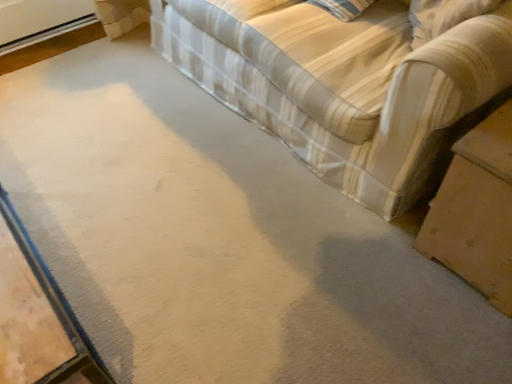
Question: Choose the correct answer: Is striped fabric couch at upper right inside wooden table at lower right or outside it?

Choices:
 (A) outside
 (B) inside

Answer: (A)

Question: From a real-world perspective, is striped fabric couch at upper right above or below wooden table at lower right?

Choices:
 (A) above
 (B) below

Answer: (A)

Question: Considering the positions of striped fabric couch at upper right and wooden table at lower right in the image, is striped fabric couch at upper right taller or shorter than wooden table at lower right?

Choices:
 (A) tall
 (B) short

Answer: (A)

Question: From a real-world perspective, is wooden table at lower right physically located above or below striped fabric couch at upper right?

Choices:
 (A) below
 (B) above

Answer: (A)

Question: Do you think wooden table at lower right is within striped fabric couch at upper right, or outside of it?

Choices:
 (A) inside
 (B) outside

Answer: (B)

Question: Considering the relative positions of wooden table at lower right and striped fabric couch at upper right in the image provided, is wooden table at lower right to the left or to the right of striped fabric couch at upper right?

Choices:
 (A) right
 (B) left

Answer: (A)

Question: Is wooden table at lower right taller or shorter than striped fabric couch at upper right?

Choices:
 (A) short
 (B) tall

Answer: (A)